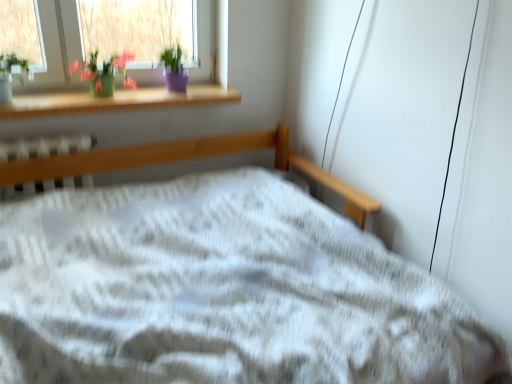
Locate an element on the screen. This screenshot has height=384, width=512. blank space situated above wooden at upper left (from a real-world perspective) is located at coordinates (116, 100).